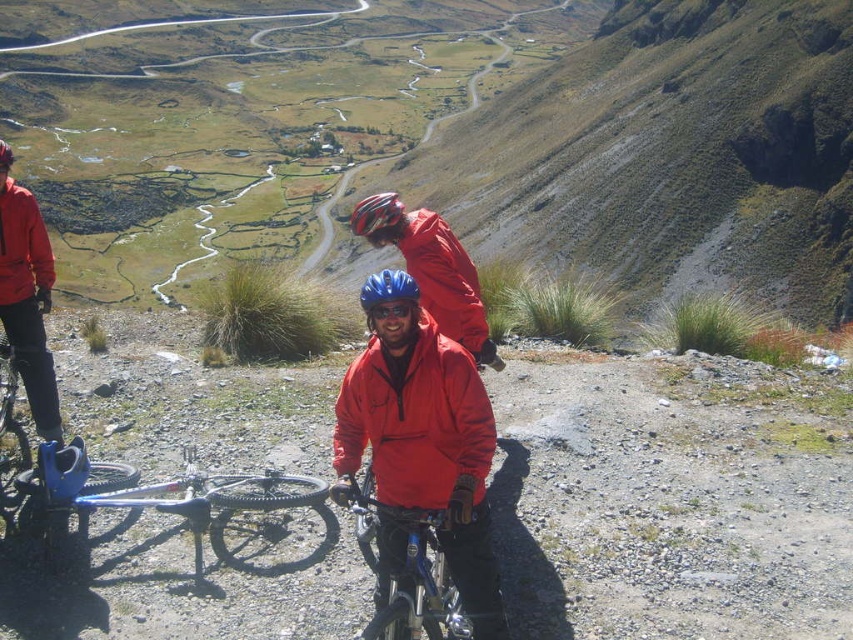
You are a photographer trying to capture a closeup of the matte red jacket at center and the matte black helmet at center. Which object should you zoom in on to get a clearer image without moving your camera?

The matte red jacket at center is smaller in size compared to the matte black helmet at center, so zooming in on the matte red jacket at center would allow you to capture a clearer image without moving the camera.

You are a photographer standing at the camera position. You want to take a closeup shot of the blue metallic bicycle at lower left. Considering the distance, do you think you can reach it without moving from your current position?

The blue metallic bicycle at lower left is 13.37 meters away from camera. Since the photographer is at the camera position, they would need to move closer to capture a closeup shot, as 13.37 meters is too far for a closeup without moving.